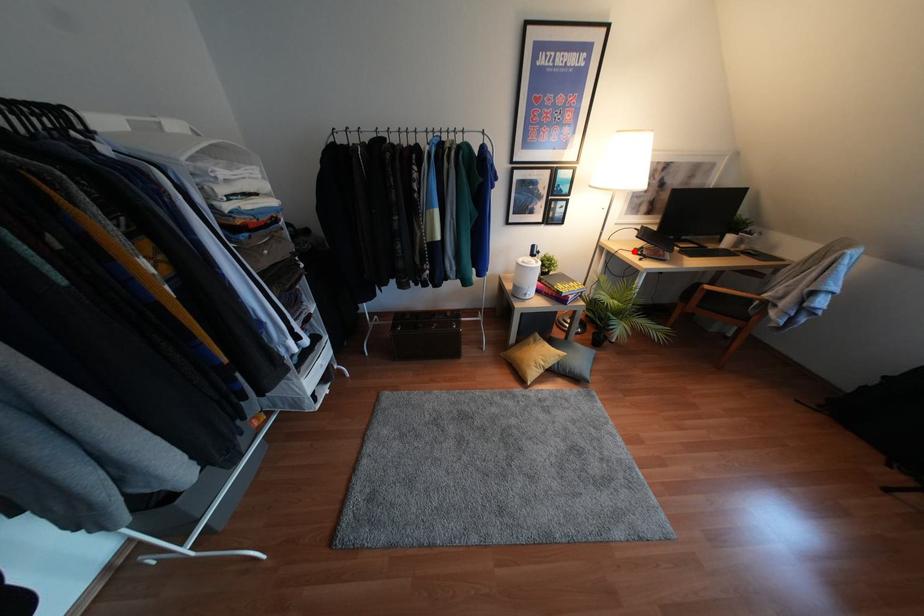
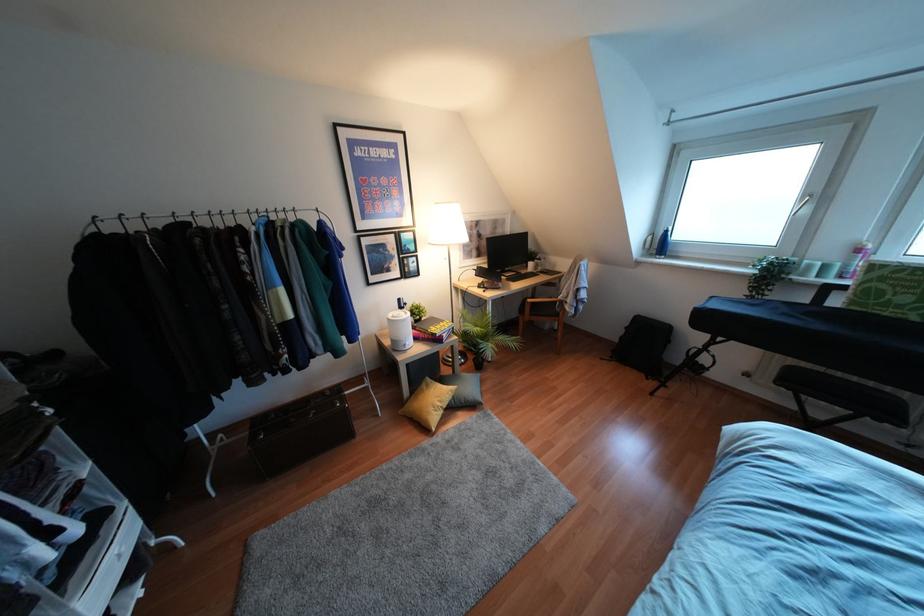
Question: A red point is marked in image1. In image2, is the corresponding 3D point closer to the camera or farther? Reply with the corresponding letter.

Choices:
 (A) The corresponding 3D point is closer.
 (B) The corresponding 3D point is farther.

Answer: (B)